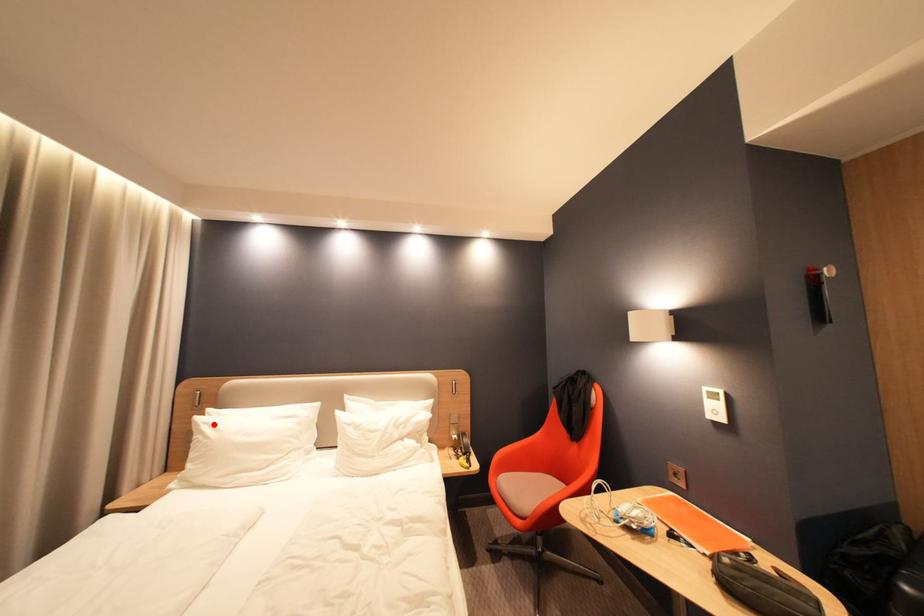
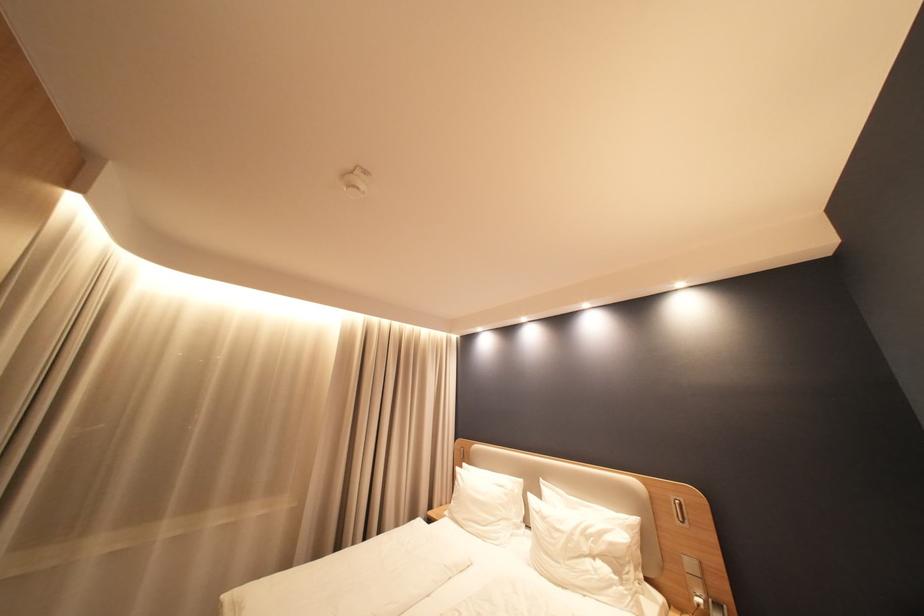
Find the pixel in the second image that matches the highlighted location in the first image.

(468, 475)